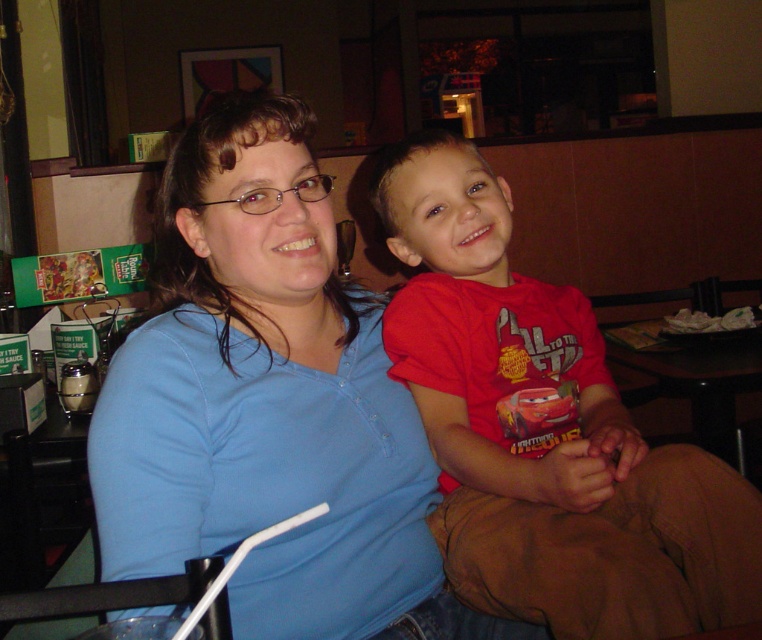
Does blue cotton shirt at center appear under red cotton shirt at center?

Yes.

The height and width of the screenshot is (640, 762). Describe the element at coordinates (267, 404) in the screenshot. I see `blue cotton shirt at center` at that location.

Locate an element on the screen. This screenshot has height=640, width=762. blue cotton shirt at center is located at coordinates (267, 404).